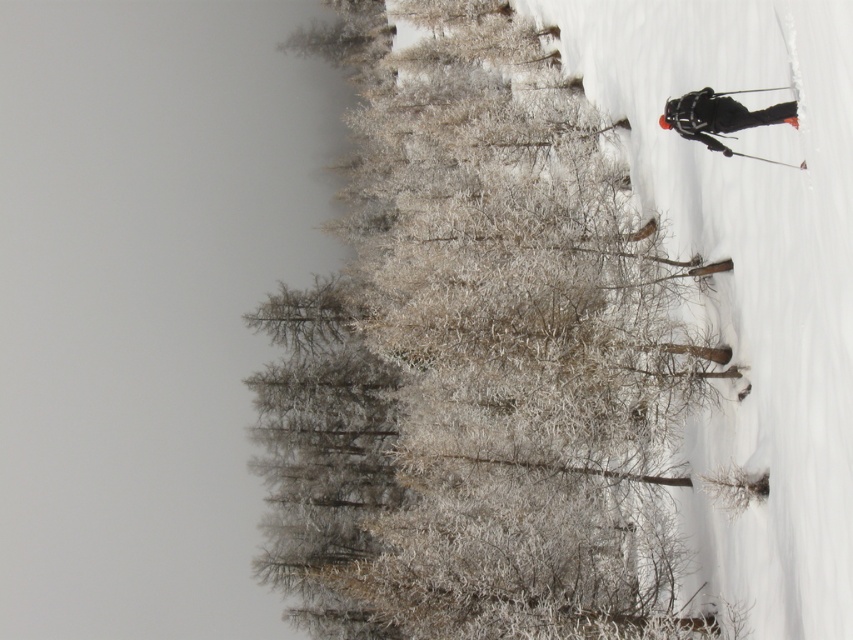
Between frosted snow-covered trees at center and white snow at right, which one has more height?

Standing taller between the two is frosted snow-covered trees at center.

In the scene shown: Between frosted snow-covered trees at center and white snow at right, which one has less height?

With less height is white snow at right.

Identify the location of frosted snow-covered trees at center. The height and width of the screenshot is (640, 853). (474, 358).

Identify the location of frosted snow-covered trees at center. This screenshot has width=853, height=640. (474, 358).

Which is behind, point (560, 438) or point (751, 116)?

Positioned behind is point (560, 438).

Can you confirm if frosted snow-covered trees at center is shorter than black matte ski suit at right?

No.

At what (x,y) coordinates should I click in order to perform the action: click on frosted snow-covered trees at center. Please return your answer as a coordinate pair (x, y). Looking at the image, I should click on (474, 358).

Is white snow at right below black matte ski suit at right?

Actually, white snow at right is above black matte ski suit at right.

Who is more distant from viewer, [664,232] or [721,125]?

The point [664,232] is behind.

Which is in front, point (703, 525) or point (747, 112)?

Point (747, 112) is in front.

Image resolution: width=853 pixels, height=640 pixels. Identify the location of white snow at right. (750, 278).